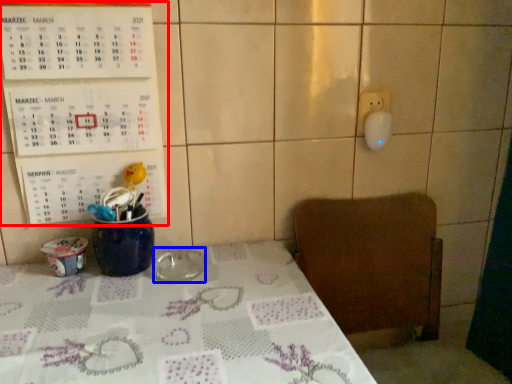
Question: Which object appears farthest to the camera in this image, bulletin board (highlighted by a red box) or tableware (highlighted by a blue box)?

Choices:
 (A) bulletin board
 (B) tableware

Answer: (B)